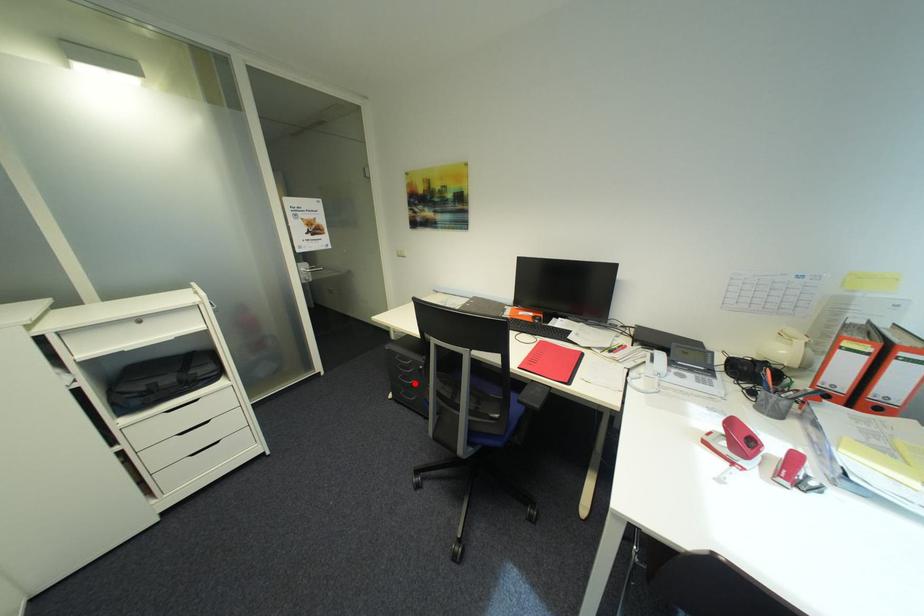
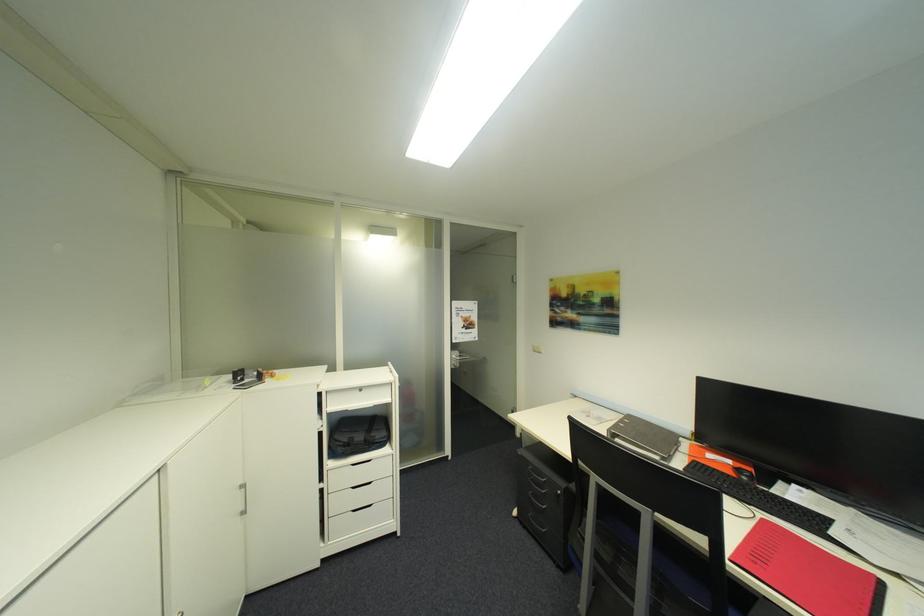
Question: I am providing you with two images of the same scene from different viewpoints. In image1, a red point is highlighted. Considering the same 3D point in image2, which of the following is correct?

Choices:
 (A) It is closer
 (B) It is farther

Answer: (A)